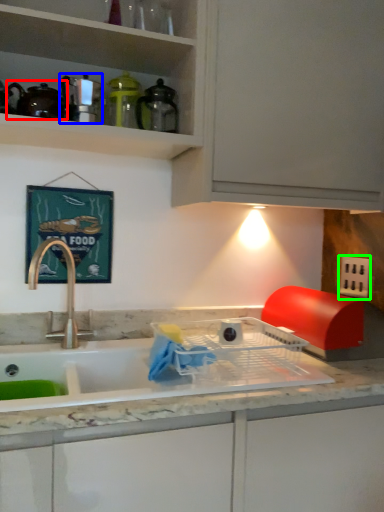
Question: Which is nearer to the tea pot (highlighted by a red box)? appliance (highlighted by a blue box) or electric outlet (highlighted by a green box).

Choices:
 (A) appliance
 (B) electric outlet

Answer: (A)